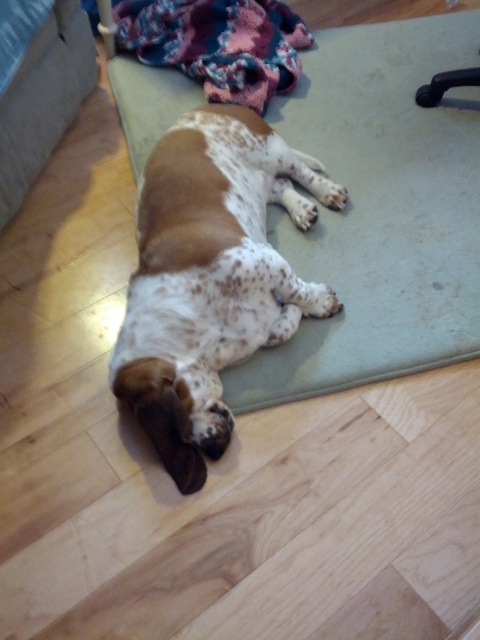
Question: Which object appears farthest from the camera in this image?

Choices:
 (A) green rubber yoga mat at center
 (B) speckled fur dog at center

Answer: (A)

Question: Which object is farther from the camera taking this photo?

Choices:
 (A) speckled fur dog at center
 (B) green rubber yoga mat at center

Answer: (B)

Question: In this image, where is green rubber yoga mat at center located relative to speckled fur dog at center?

Choices:
 (A) left
 (B) right

Answer: (B)

Question: Does green rubber yoga mat at center appear over speckled fur dog at center?

Choices:
 (A) no
 (B) yes

Answer: (B)

Question: Observing the image, what is the correct spatial positioning of green rubber yoga mat at center in reference to speckled fur dog at center?

Choices:
 (A) above
 (B) below

Answer: (A)